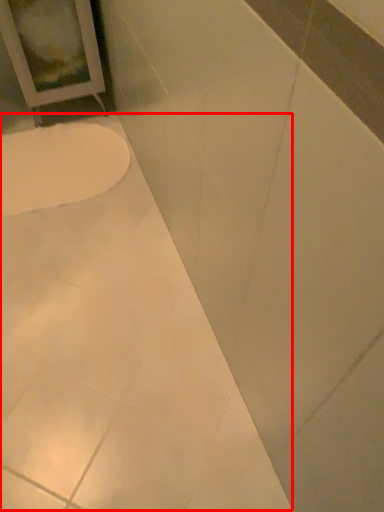
Question: In this image, where is bath (annotated by the red box) located relative to toilet?

Choices:
 (A) right
 (B) left

Answer: (A)